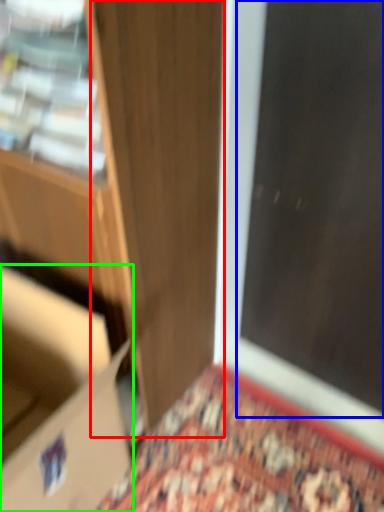
Question: Estimate the real-world distances between objects in this image. Which object is farther from door (highlighted by a red box), screen door (highlighted by a blue box) or cardboard box (highlighted by a green box)?

Choices:
 (A) screen door
 (B) cardboard box

Answer: (A)